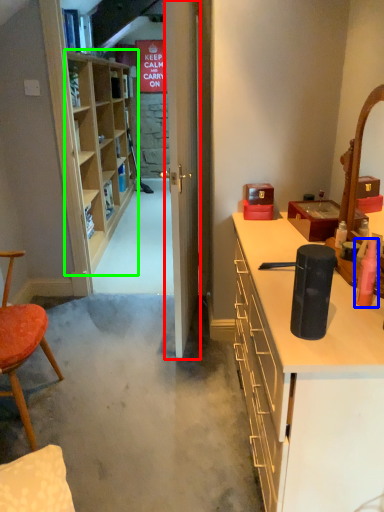
Question: Which object is the closest to the door (highlighted by a red box)? Choose among these: toiletry (highlighted by a blue box) or shelf (highlighted by a green box).

Choices:
 (A) toiletry
 (B) shelf

Answer: (A)